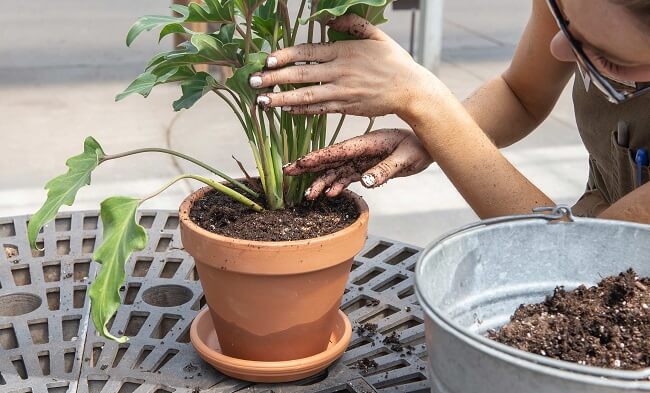
You are a GUI agent. You are given a task and a screenshot of the screen. Output one action in this format:
    pyautogui.click(x=<x>, y=<y>)
    Task: Click on the plant
    The height and width of the screenshot is (393, 650).
    Given the screenshot: What is the action you would take?
    pyautogui.click(x=277, y=184)